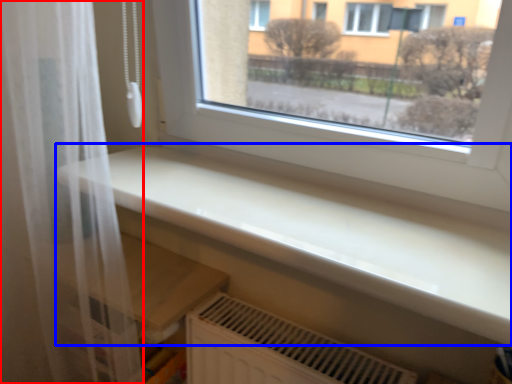
Question: Which point is further to the camera, shower curtain (highlighted by a red box) or counter top (highlighted by a blue box)?

Choices:
 (A) shower curtain
 (B) counter top

Answer: (A)